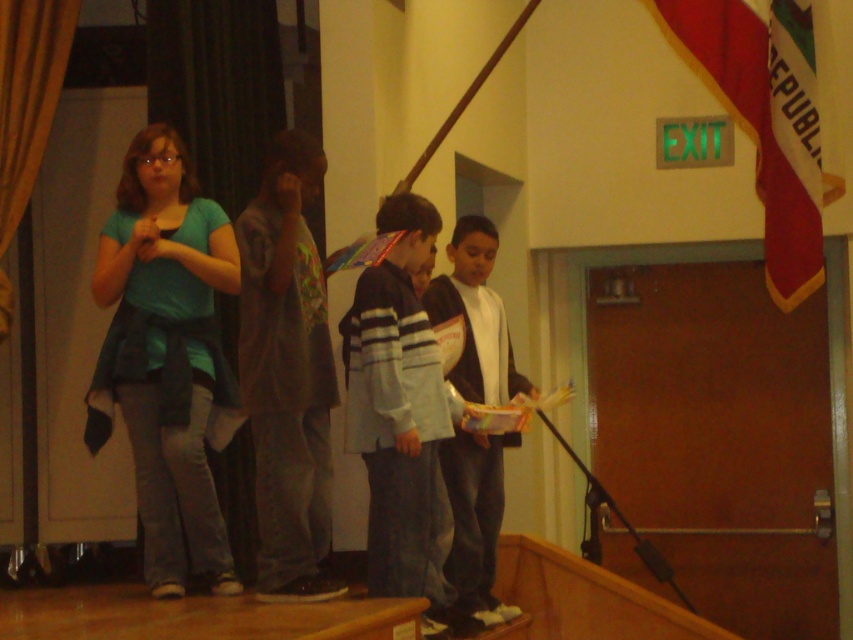
Is striped sweater at center closer to camera compared to red fabric flag at upper right?

Yes.

Who is taller, striped sweater at center or red fabric flag at upper right?

Standing taller between the two is striped sweater at center.

Which is in front, point (392, 528) or point (790, 250)?

Positioned in front is point (392, 528).

The width and height of the screenshot is (853, 640). Find the location of `striped sweater at center`. striped sweater at center is located at coordinates (401, 417).

Is striped sweater at center to the right of white matte jacket at center from the viewer's perspective?

In fact, striped sweater at center is to the left of white matte jacket at center.

Is point (422, 490) farther from camera compared to point (440, 298)?

That is False.

Is point (405, 461) positioned before point (480, 401)?

Yes.

You are a GUI agent. You are given a task and a screenshot of the screen. Output one action in this format:
    pyautogui.click(x=<x>, y=<y>)
    Task: Click on the striped sweater at center
    This screenshot has height=640, width=853.
    Given the screenshot: What is the action you would take?
    pyautogui.click(x=401, y=417)

Is teal fabric shirt at left taller than red fabric flag at upper right?

Yes.

Which is in front, point (160, 532) or point (784, 308)?

Point (160, 532) is more forward.

Locate an element on the screen. teal fabric shirt at left is located at coordinates (165, 355).